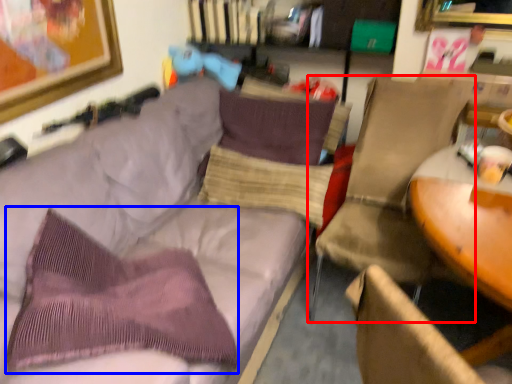
Question: Which point is further to the camera, chair (highlighted by a red box) or throw pillow (highlighted by a blue box)?

Choices:
 (A) chair
 (B) throw pillow

Answer: (A)